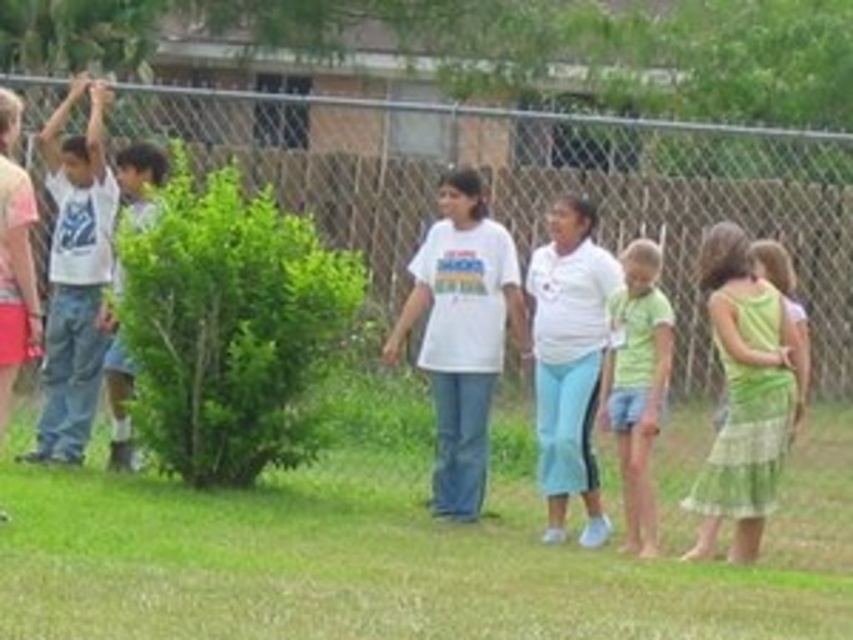
Is point (68, 301) positioned behind point (643, 460)?

Yes, it is behind point (643, 460).

Can you confirm if white cotton shirt at left is positioned below green cotton shirt at center?

Incorrect, white cotton shirt at left is not positioned below green cotton shirt at center.

Does point (85, 272) lie behind point (642, 394)?

Yes, point (85, 272) is farther from viewer.

Where is `white cotton shirt at left`? This screenshot has width=853, height=640. white cotton shirt at left is located at coordinates (74, 275).

Does point (677, 317) come behind point (33, 209)?

Yes, point (677, 317) is behind point (33, 209).

The image size is (853, 640). I want to click on chain-link fence at upper center, so click(x=537, y=188).

Who is positioned more to the right, chain-link fence at upper center or light blue jeans at left?

Positioned to the right is chain-link fence at upper center.

Measure the distance from chain-link fence at upper center to light blue jeans at left.

A distance of 18.80 feet exists between chain-link fence at upper center and light blue jeans at left.

Is point (648, 198) closer to camera compared to point (122, 433)?

No, (648, 198) is behind (122, 433).

Where is `chain-link fence at upper center`? This screenshot has height=640, width=853. chain-link fence at upper center is located at coordinates (537, 188).